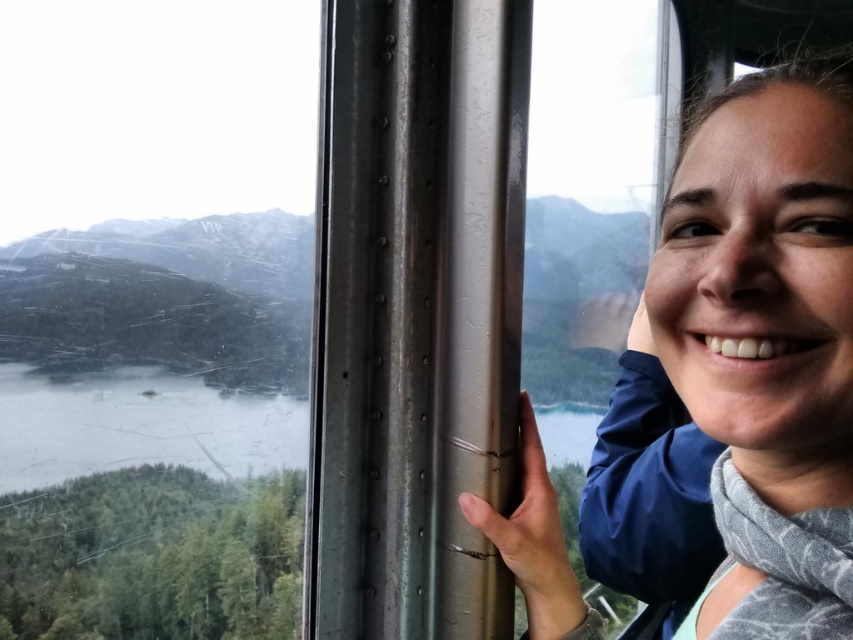
Where is the matte blue jacket at right located in the image?

The matte blue jacket at right is located at point (764,346) in the image.

You are a passenger in the cable car and want to take a photo of the green matte water at center without the matte blue jacket at right blocking the view. Is there a way to position yourself so the jacket isn

The matte blue jacket at right is in front of the green matte water at center, so moving to the left side of the cable car would position the camera to capture the green matte water at center without the jacket obstructing the view.

You are designing a poster for a travel agency and need to highlight the size comparison between the matte blue jacket at right and the green matte water at center in the image. Which object is narrower?

The matte blue jacket at right is narrower than the green matte water at center because its width is less than the water.